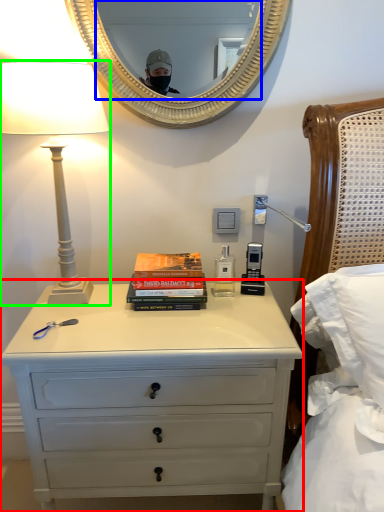
Question: Based on their relative distances, which object is nearer to chest of drawers (highlighted by a red box)? Choose from mirror (highlighted by a blue box) and lamp (highlighted by a green box).

Choices:
 (A) mirror
 (B) lamp

Answer: (B)